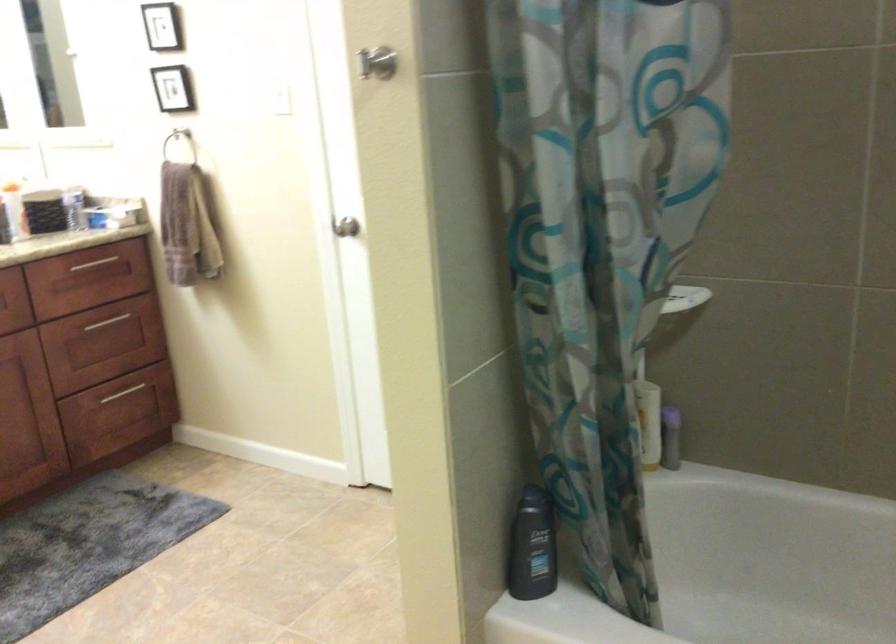
The height and width of the screenshot is (644, 896). I want to click on silver wall hook, so click(376, 62).